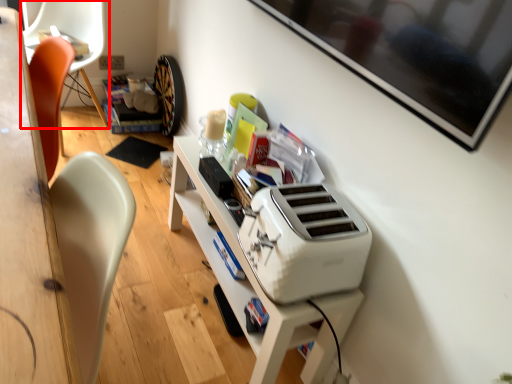
Question: From the image's perspective, what is the correct spatial relationship of chair (annotated by the red box) in relation to home appliance?

Choices:
 (A) above
 (B) below

Answer: (A)